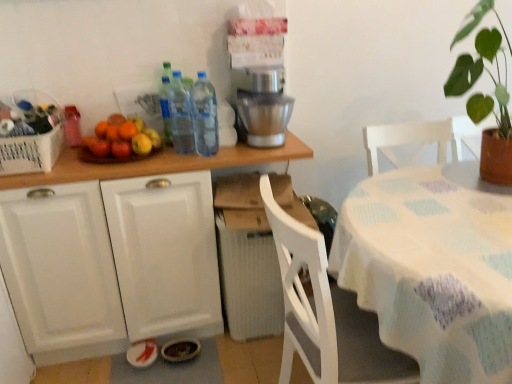
Locate an element on the screen. free spot in front of translucent plastic bottles at upper center, which is the second bottle in left-to-right order is located at coordinates (178, 160).